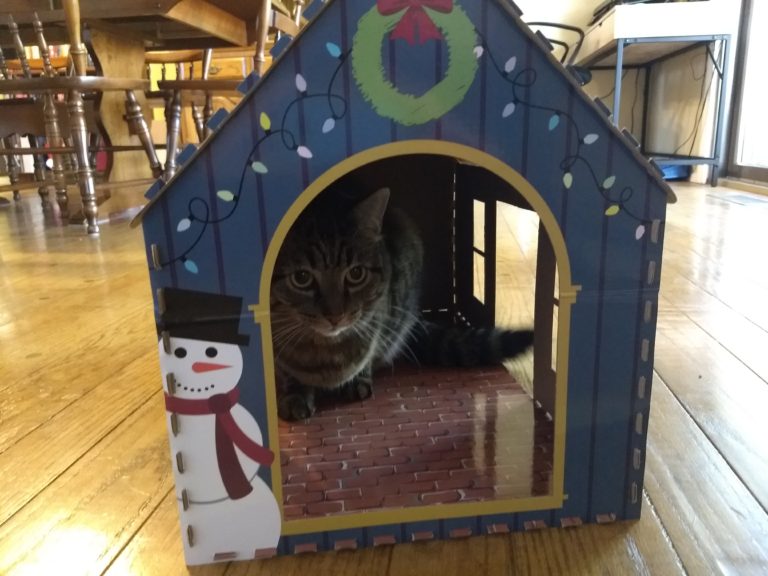
At what (x,y) coordinates should I click in order to perform the action: click on desk. Please return your answer as a coordinate pair (x, y). Looking at the image, I should click on (667, 18).